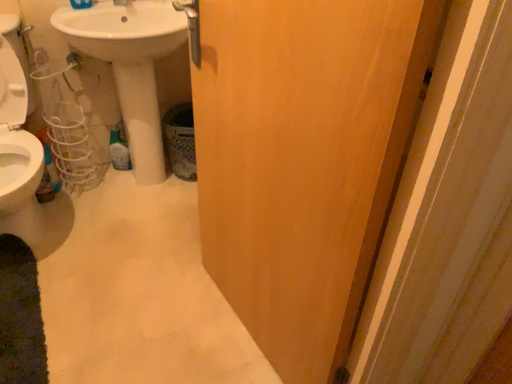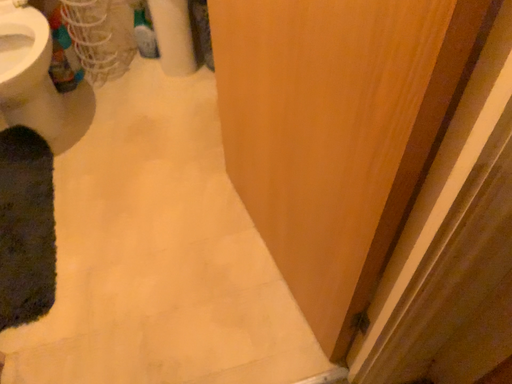
Question: How did the camera likely rotate when shooting the video?

Choices:
 (A) rotated right
 (B) rotated left

Answer: (B)